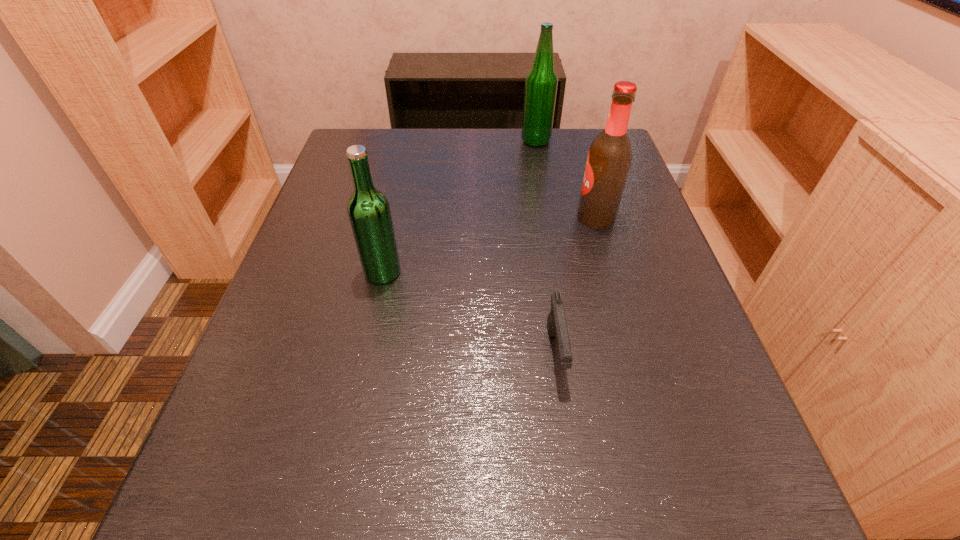
Find the location of a particular element. the third nearest object is located at coordinates (609, 158).

Locate an element on the screen. This screenshot has height=540, width=960. the rightmost beer bottle is located at coordinates 609,158.

You are a GUI agent. You are given a task and a screenshot of the screen. Output one action in this format:
    pyautogui.click(x=<x>, y=<y>)
    Task: Click on the farthest beer bottle
    The image size is (960, 540).
    Given the screenshot: What is the action you would take?
    pyautogui.click(x=541, y=82)

Locate an element on the screen. the farthest object is located at coordinates (541, 82).

Locate an element on the screen. the nearest beer bottle is located at coordinates (369, 212).

Image resolution: width=960 pixels, height=540 pixels. I want to click on the leftmost beer bottle, so coord(369,212).

The image size is (960, 540). What are the coordinates of `pistol` in the screenshot? It's located at (556, 322).

Identify the location of the nearest object. (556, 322).

This screenshot has width=960, height=540. What are the coordinates of `vacant space positioned 0.170m on the left of the third nearest object` in the screenshot? It's located at (497, 218).

Identify the location of free space located 0.130m on the label of the second beer bottle from left to right. (471, 141).